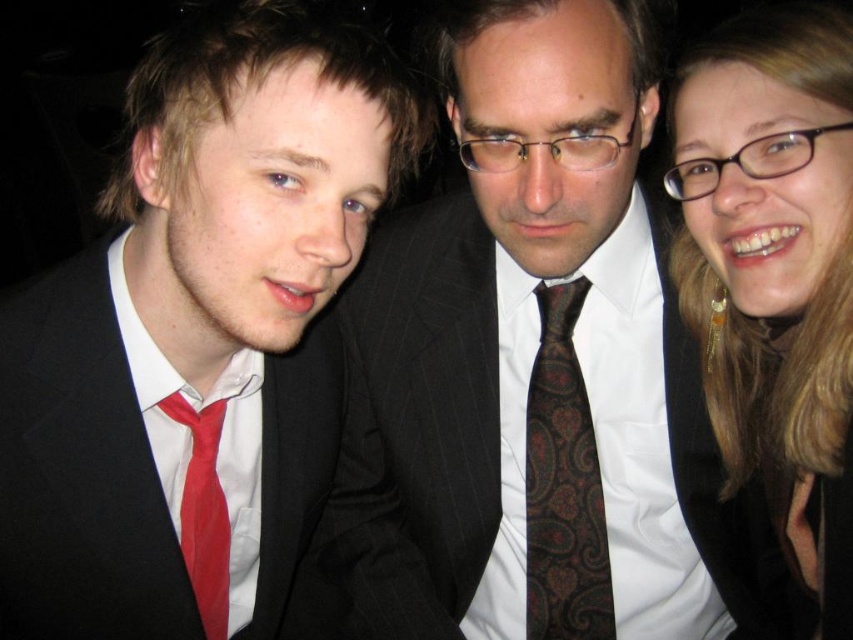
Who is taller, matte black suit at left or red satin tie at left?

Standing taller between the two is matte black suit at left.

Who is lower down, matte black suit at left or red satin tie at left?

red satin tie at left is lower down.

Which is behind, point (96, 246) or point (222, 403)?

The point (222, 403) is more distant.

The width and height of the screenshot is (853, 640). I want to click on matte black suit at left, so click(80, 474).

Looking at this image, who is taller, matte black jacket at upper right or matte black suit at left?

With more height is matte black jacket at upper right.

Does matte black jacket at upper right appear under matte black suit at left?

Actually, matte black jacket at upper right is above matte black suit at left.

Is point (822, 477) positioned before point (13, 477)?

No, (822, 477) is behind (13, 477).

This screenshot has width=853, height=640. What are the coordinates of `matte black jacket at upper right` in the screenshot? It's located at (775, 269).

Is matte black jacket at upper right bigger than brown paisley tie at center?

Correct, matte black jacket at upper right is larger in size than brown paisley tie at center.

Which of these two, matte black jacket at upper right or brown paisley tie at center, stands taller?

matte black jacket at upper right is taller.

The image size is (853, 640). I want to click on matte black jacket at upper right, so click(x=775, y=269).